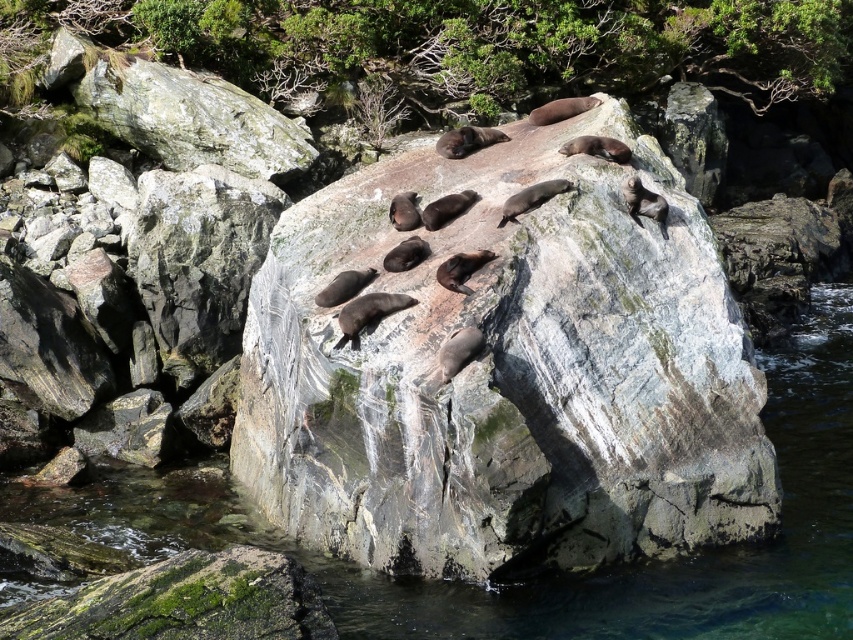
Question: Is smooth gray rock at center further to the viewer compared to clear water at rock center?

Choices:
 (A) yes
 (B) no

Answer: (B)

Question: Is smooth gray rock at center above clear water at rock center?

Choices:
 (A) no
 (B) yes

Answer: (B)

Question: Is smooth gray rock at center positioned behind clear water at rock center?

Choices:
 (A) yes
 (B) no

Answer: (B)

Question: Which of the following is the closest to the observer?

Choices:
 (A) (815, 557)
 (B) (312, 368)

Answer: (B)

Question: Which object is farther from the camera taking this photo?

Choices:
 (A) smooth gray rock at center
 (B) clear water at rock center

Answer: (B)